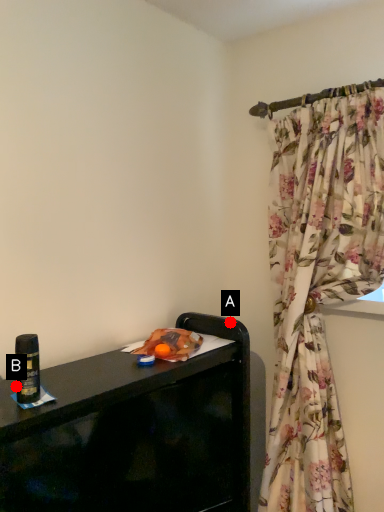
Question: Two points are circled on the image, labeled by A and B beside each circle. Which point appears closest to the camera in this image?

Choices:
 (A) A is closer
 (B) B is closer

Answer: (B)